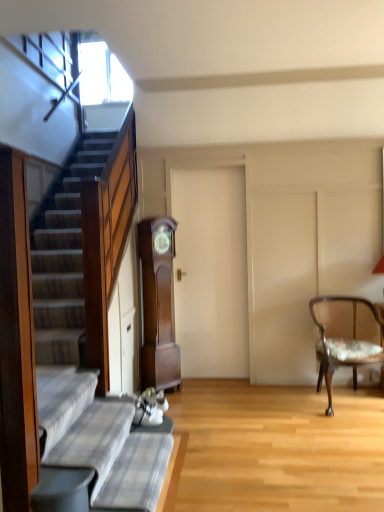
At what (x,y) coordinates should I click in order to perform the action: click on vacant area that is situated to the right of plaid fabric couch at lower left. Please return your answer as a coordinate pair (x, y). Looking at the image, I should click on (236, 486).